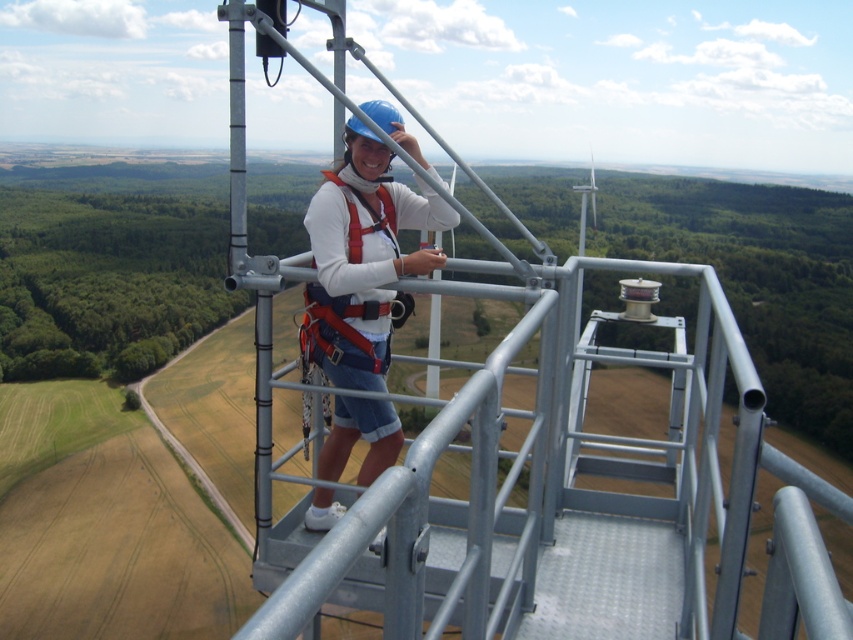
You are a safety inspector and need to locate the exact position of the point with coordinates [364,257] on the image. Based on the scene description, where would this point be located?

The point with coordinates [364,257] is on the matte white shirt at center.

You are an inspector checking the safety equipment on the platform. You notice the matte white shirt at center and the red nylon safety vest at center. Which piece of clothing is positioned higher on the person?

The matte white shirt at center is much taller than the red nylon safety vest at center, so the matte white shirt at center is positioned higher on the person.

You are a safety inspector analyzing the image. The safety regulations state that all workers must keep their shirts tucked in. Can you determine if the matte white shirt at center is positioned in a way that suggests it is tucked in?

The 2D location of matte white shirt at center is at point (x=364, y=257), but without additional information about the position of the pants or belt, it is impossible to determine if the shirt is tucked in based on coordinates alone.